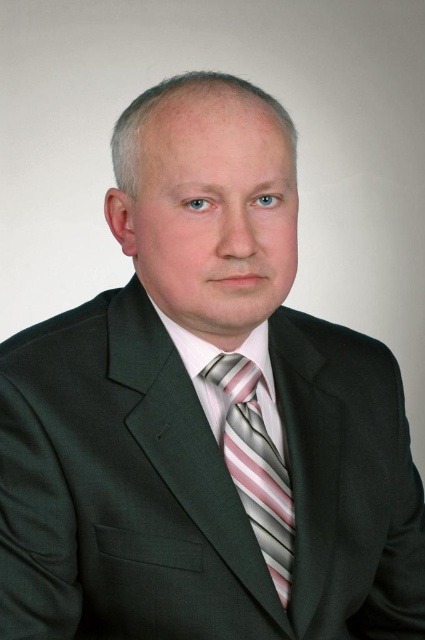
Question: Where is striped silk tie at center located in relation to pink striped dress shirt at center in the image?

Choices:
 (A) left
 (B) right

Answer: (B)

Question: Can you confirm if striped silk tie at center is smaller than pink striped dress shirt at center?

Choices:
 (A) no
 (B) yes

Answer: (B)

Question: Which point is closer to the camera taking this photo?

Choices:
 (A) pyautogui.click(x=217, y=413)
 (B) pyautogui.click(x=244, y=419)

Answer: (B)

Question: Which point appears farthest from the camera in this image?

Choices:
 (A) (243, 488)
 (B) (266, 369)

Answer: (B)

Question: Which object is closer to the camera taking this photo?

Choices:
 (A) pink striped dress shirt at center
 (B) striped silk tie at center

Answer: (B)

Question: Is striped silk tie at center to the right of pink striped dress shirt at center from the viewer's perspective?

Choices:
 (A) no
 (B) yes

Answer: (B)